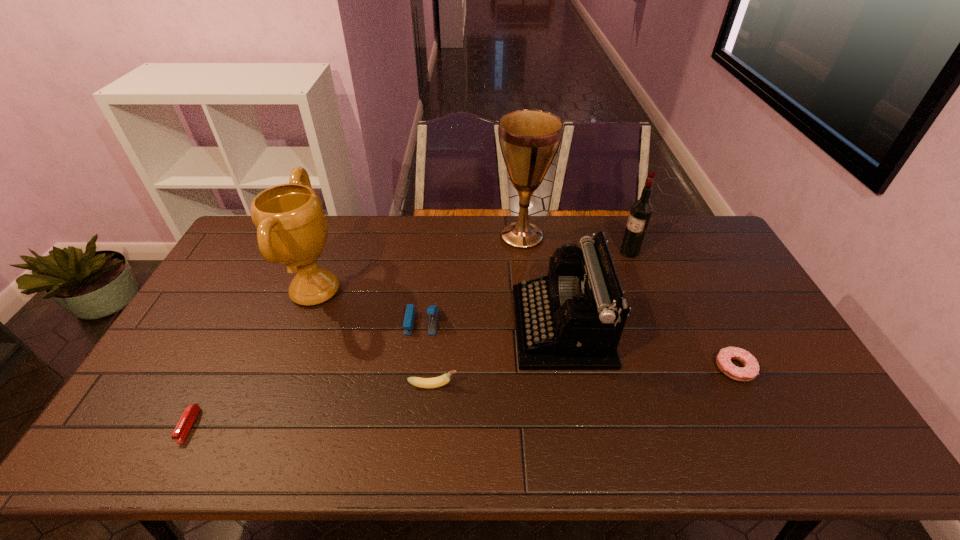
You are a GUI agent. You are given a task and a screenshot of the screen. Output one action in this format:
    pyautogui.click(x=<x>, y=<y>)
    Task: Click on the vacant space at the near edge of the desktop
    This screenshot has height=540, width=960.
    Given the screenshot: What is the action you would take?
    pyautogui.click(x=405, y=458)

Where is `free space at the left edge of the desktop`? The height and width of the screenshot is (540, 960). free space at the left edge of the desktop is located at coordinates (x=162, y=419).

Where is `free space at the right edge of the desktop`? free space at the right edge of the desktop is located at coordinates (735, 276).

Find the location of a particular element. The width and height of the screenshot is (960, 540). vacant space at the far right corner of the desktop is located at coordinates (673, 233).

Locate an element on the screen. This screenshot has height=540, width=960. vacant area that lies between the fifth shortest object and the banana is located at coordinates [x=497, y=356].

Find the location of `empty space between the fifth shortest object and the rightmost object`. empty space between the fifth shortest object and the rightmost object is located at coordinates (648, 347).

At what (x,y) coordinates should I click in order to perform the action: click on vacant area that lies between the tallest object and the rightmost object. Please return your answer as a coordinate pair (x, y). Looking at the image, I should click on (629, 302).

The width and height of the screenshot is (960, 540). What are the coordinates of `unoccupied area between the award and the seventh object from left to right` in the screenshot? It's located at (472, 272).

At what (x,y) coordinates should I click in order to perform the action: click on vacant area that lies between the second object from left to right and the taller stapler. Please return your answer as a coordinate pair (x, y). The image size is (960, 540). Looking at the image, I should click on (369, 307).

Identify the location of object identified as the third closest to the fifth shortest object. (640, 213).